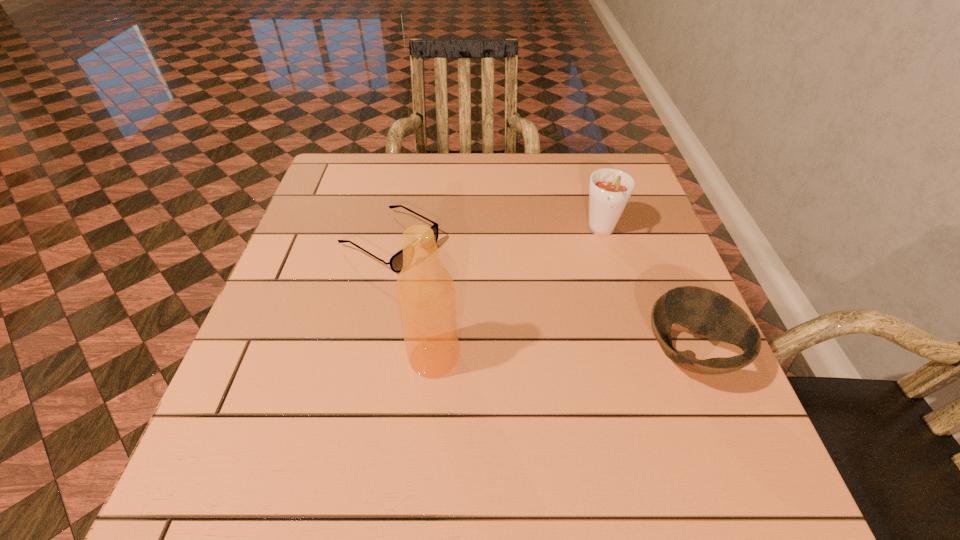
You are a GUI agent. You are given a task and a screenshot of the screen. Output one action in this format:
    pyautogui.click(x=<x>, y=<y>)
    Task: Click on the free spot between the tallest object and the second shortest object
    
    Given the screenshot: What is the action you would take?
    pyautogui.click(x=562, y=356)

Where is `empty space between the third shortest object and the bowl`? The width and height of the screenshot is (960, 540). empty space between the third shortest object and the bowl is located at coordinates (645, 293).

Select which object is the closest to the beer bottle. Please provide its 2D coordinates. Your answer should be formatted as a tuple, i.e. [(x, y)], where the tuple contains the x and y coordinates of a point satisfying the conditions above.

[(396, 262)]

At what (x,y) coordinates should I click in order to perform the action: click on the closest object to the third tallest object. Please return your answer as a coordinate pair (x, y). This screenshot has height=540, width=960. Looking at the image, I should click on (610, 189).

This screenshot has height=540, width=960. I want to click on free space in the image that satisfies the following two spatial constraints: 1. on the front side of the shortest object; 2. on the right side of the beer bottle, so click(x=366, y=357).

Image resolution: width=960 pixels, height=540 pixels. In order to click on vacant position in the image that satisfies the following two spatial constraints: 1. on the back side of the root beer; 2. on the right side of the spectacles in this screenshot , I will do `click(392, 232)`.

Locate an element on the screen. This screenshot has height=540, width=960. vacant area in the image that satisfies the following two spatial constraints: 1. on the front side of the shortest object; 2. on the left side of the tallest object is located at coordinates (366, 357).

The width and height of the screenshot is (960, 540). In order to click on free space that satisfies the following two spatial constraints: 1. on the back side of the root beer; 2. on the left side of the beer bottle in this screenshot , I will do `click(444, 232)`.

The image size is (960, 540). What are the coordinates of `vacant space that satisfies the following two spatial constraints: 1. on the front side of the spectacles; 2. on the left side of the third tallest object` in the screenshot? It's located at (366, 354).